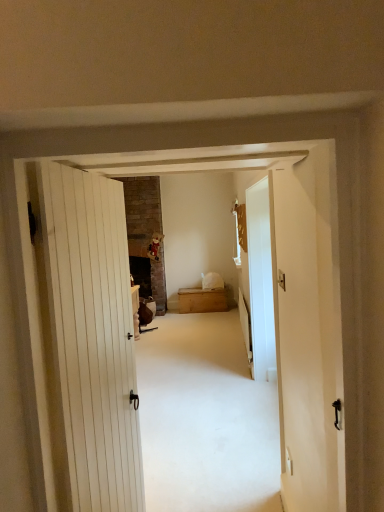
Question: From the image's perspective, is wooden chest at center located above or below transparent glass door at right?

Choices:
 (A) below
 (B) above

Answer: (A)

Question: Relative to transparent glass door at right, is wooden chest at center in front or behind?

Choices:
 (A) front
 (B) behind

Answer: (B)

Question: Is wooden chest at center bigger or smaller than transparent glass door at right?

Choices:
 (A) small
 (B) big

Answer: (B)

Question: From a real-world perspective, relative to wooden chest at center, is transparent glass door at right vertically above or below?

Choices:
 (A) above
 (B) below

Answer: (A)

Question: In terms of height, does transparent glass door at right look taller or shorter compared to wooden chest at center?

Choices:
 (A) tall
 (B) short

Answer: (A)

Question: Would you say transparent glass door at right is to the left or to the right of wooden chest at center in the picture?

Choices:
 (A) right
 (B) left

Answer: (A)

Question: Is transparent glass door at right spatially inside wooden chest at center, or outside of it?

Choices:
 (A) outside
 (B) inside

Answer: (A)